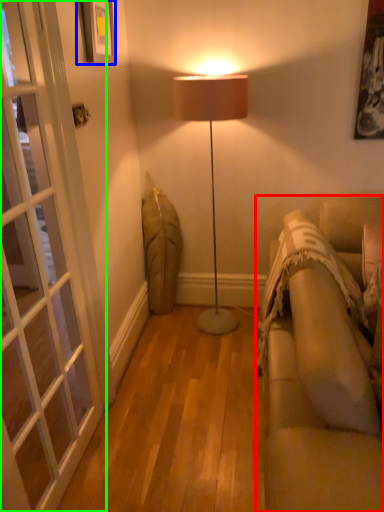
Question: Which is nearer to the studio couch (highlighted by a red box)? picture frame (highlighted by a blue box) or screen door (highlighted by a green box).

Choices:
 (A) picture frame
 (B) screen door

Answer: (B)